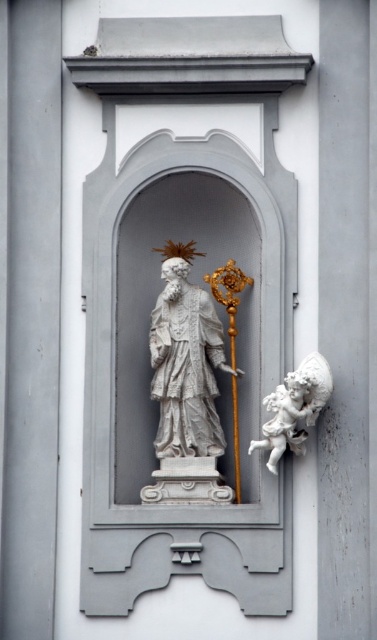
You are standing in front of the decorative niche with the statue of Saint John Nepomuk. You notice two points marked on the niche wall. The first point is at coordinates point (171, 381) and the second is at point (289, 413). Which point is closer to you?

Point (171, 381) is further to the camera than point (289, 413). Therefore, the point closer to you is point (289, 413).

You are an interior designer planning to place a new lamp in the niche where the white marble statue at center is located. The lamp requires a minimum of 0.3 meters of space around it. Given the statue is at coordinates point 0.573, 0.493, can you determine if there is enough space to place the lamp without moving the statue?

The white marble statue at center is positioned at coordinates point [185,365]. Since the lamp requires a minimum of 0.3 meters of space around it and the statue is the only object in the niche, there is sufficient space to place the lamp as long as it is positioned at least 0.3 meters away from the statue.